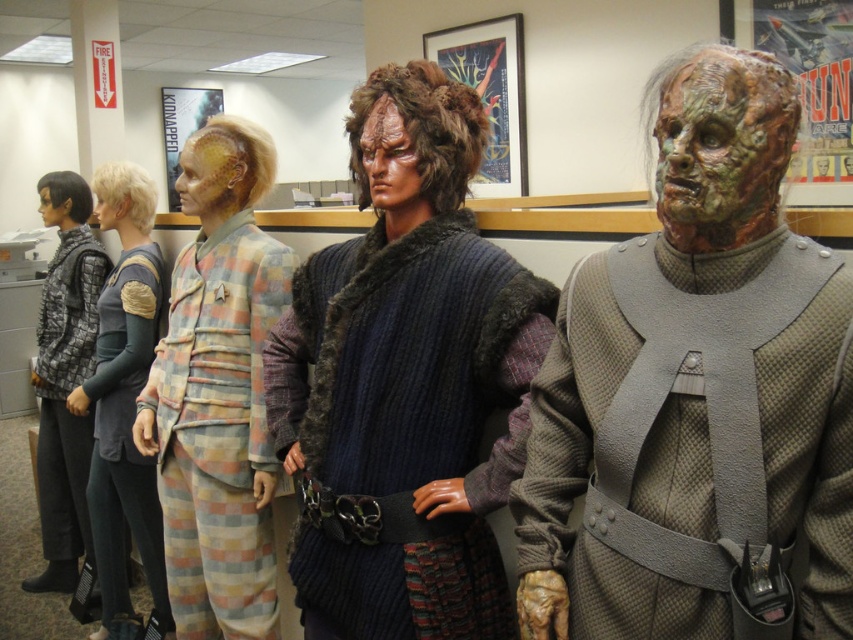
Question: Is quilted gray vest at center to the right of greenish textured mask at center from the viewer's perspective?

Choices:
 (A) no
 (B) yes

Answer: (A)

Question: Among these objects, which one is farthest from the camera?

Choices:
 (A) matte black hair at left
 (B) greenish-brown textured mask at center
 (C) gray textured uniform at center
 (D) plaid fabric suit at center

Answer: (A)

Question: Among these objects, which one is farthest from the camera?

Choices:
 (A) gray textured uniform at center
 (B) greenish-brown textured mask at center
 (C) smooth skin face at center
 (D) matte black hair at left

Answer: (D)

Question: Estimate the real-world distances between objects in this image. Which object is closer to the quilted gray vest at center?

Choices:
 (A) dark blue knitted vest at center
 (B) gray textured uniform at center
 (C) knitted wool sweater at center

Answer: (C)

Question: Where is greenish textured mask at center located in relation to smooth skin face at center in the image?

Choices:
 (A) left
 (B) right

Answer: (B)

Question: Can you confirm if gray textured uniform at center is positioned below plaid fabric suit at center?

Choices:
 (A) yes
 (B) no

Answer: (B)